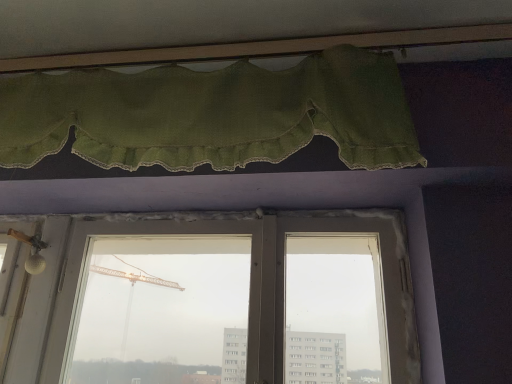
In order to face green fabric curtain at upper center, should I rotate leftwards or rightwards?

It's best to rotate left around 10.299 degrees.

Locate an element on the screen. The image size is (512, 384). green fabric curtain at upper center is located at coordinates (213, 114).

The height and width of the screenshot is (384, 512). What do you see at coordinates (213, 114) in the screenshot?
I see `green fabric curtain at upper center` at bounding box center [213, 114].

Find the location of a particular element. This screenshot has width=512, height=384. transparent glass window at center is located at coordinates (234, 301).

Describe the element at coordinates (234, 301) in the screenshot. The image size is (512, 384). I see `transparent glass window at center` at that location.

You are a GUI agent. You are given a task and a screenshot of the screen. Output one action in this format:
    pyautogui.click(x=<x>, y=<y>)
    Task: Click on the green fabric curtain at upper center
    This screenshot has height=384, width=512.
    Given the screenshot: What is the action you would take?
    pyautogui.click(x=213, y=114)

Which is more to the right, green fabric curtain at upper center or transparent glass window at center?

transparent glass window at center is more to the right.

Who is more distant, green fabric curtain at upper center or transparent glass window at center?

transparent glass window at center is further from the camera.

Is point (180, 142) positioned behind point (212, 309)?

No, (180, 142) is closer to viewer.

From the image's perspective, who appears lower, green fabric curtain at upper center or transparent glass window at center?

transparent glass window at center, from the image's perspective.

From a real-world perspective, is green fabric curtain at upper center on top of transparent glass window at center?

Yes, from a real-world perspective, green fabric curtain at upper center is above transparent glass window at center.

Looking at this image, is green fabric curtain at upper center thinner than transparent glass window at center?

In fact, green fabric curtain at upper center might be wider than transparent glass window at center.

In terms of height, does green fabric curtain at upper center look taller or shorter compared to transparent glass window at center?

Clearly, green fabric curtain at upper center is shorter compared to transparent glass window at center.

Who is bigger, green fabric curtain at upper center or transparent glass window at center?

Bigger between the two is green fabric curtain at upper center.

Is green fabric curtain at upper center located outside transparent glass window at center?

green fabric curtain at upper center lies outside transparent glass window at center's area.

Is green fabric curtain at upper center next to transparent glass window at center and touching it?

No.

Is green fabric curtain at upper center aimed at transparent glass window at center?

No, green fabric curtain at upper center does not turn towards transparent glass window at center.

How many degrees apart are the facing directions of green fabric curtain at upper center and transparent glass window at center?

The angular difference between green fabric curtain at upper center and transparent glass window at center is 0.000942 degrees.

How distant is green fabric curtain at upper center from transparent glass window at center?

green fabric curtain at upper center is 49.47 centimeters from transparent glass window at center.

In order to click on window that is on the right side of green fabric curtain at upper center in this screenshot , I will do `click(234, 301)`.

Would you say transparent glass window at center is to the left or to the right of green fabric curtain at upper center in the picture?

In the image, transparent glass window at center appears on the right side of green fabric curtain at upper center.

Based on the photo, does transparent glass window at center lie in front of green fabric curtain at upper center?

No, transparent glass window at center is further to the viewer.

Which is further, (323, 276) or (21, 123)?

The point (323, 276) is behind.

Based on the photo, from the image's perspective, is transparent glass window at center beneath green fabric curtain at upper center?

Correct, transparent glass window at center appears lower than green fabric curtain at upper center in the image.

From a real-world perspective, between transparent glass window at center and green fabric curtain at upper center, who is vertically lower?

In real-world perspective, transparent glass window at center is lower.

Does transparent glass window at center have a greater width compared to green fabric curtain at upper center?

In fact, transparent glass window at center might be narrower than green fabric curtain at upper center.

Considering the sizes of objects transparent glass window at center and green fabric curtain at upper center in the image provided, who is taller, transparent glass window at center or green fabric curtain at upper center?

With more height is transparent glass window at center.

Can you confirm if transparent glass window at center is bigger than green fabric curtain at upper center?

Actually, transparent glass window at center might be smaller than green fabric curtain at upper center.

Which is correct: transparent glass window at center is inside green fabric curtain at upper center, or outside of it?

transparent glass window at center is located beyond the bounds of green fabric curtain at upper center.

Is transparent glass window at center next to green fabric curtain at upper center and touching it?

No, transparent glass window at center is not touching green fabric curtain at upper center.

Is transparent glass window at center positioned with its back to green fabric curtain at upper center?

transparent glass window at center is not turned away from green fabric curtain at upper center.

Measure the distance from transparent glass window at center to green fabric curtain at upper center.

19.48 inches.

You are a GUI agent. You are given a task and a screenshot of the screen. Output one action in this format:
    pyautogui.click(x=<x>, y=<y>)
    Task: Click on the window lying on the right of green fabric curtain at upper center
    
    Given the screenshot: What is the action you would take?
    pyautogui.click(x=234, y=301)

The width and height of the screenshot is (512, 384). In order to click on window below the green fabric curtain at upper center (from a real-world perspective) in this screenshot , I will do `click(234, 301)`.

I want to click on curtain above the transparent glass window at center (from a real-world perspective), so click(213, 114).